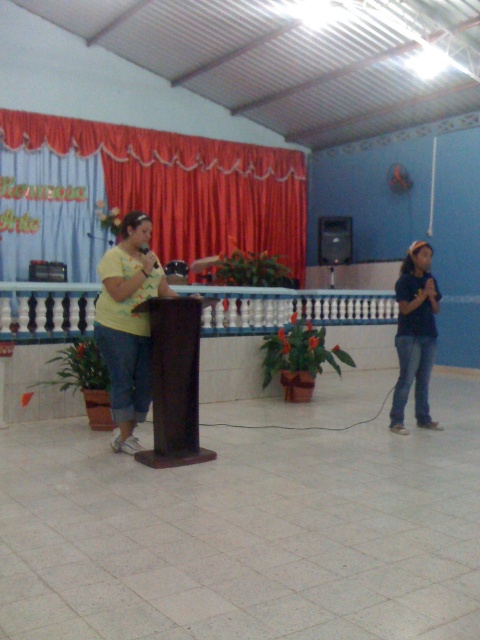
Is yellow matte shirt at center shorter than denim jeans at right?

Incorrect, yellow matte shirt at center's height does not fall short of denim jeans at right's.

Describe the element at coordinates (128, 324) in the screenshot. The image size is (480, 640). I see `yellow matte shirt at center` at that location.

Locate an element on the screen. yellow matte shirt at center is located at coordinates (128, 324).

Where is `red velvet curtain at upper center`? red velvet curtain at upper center is located at coordinates (186, 184).

Can you confirm if red velvet curtain at upper center is positioned below yellow matte shirt at center?

No.

Image resolution: width=480 pixels, height=640 pixels. Describe the element at coordinates (186, 184) in the screenshot. I see `red velvet curtain at upper center` at that location.

Where is `red velvet curtain at upper center`? red velvet curtain at upper center is located at coordinates (186, 184).

Who is positioned more to the left, red velvet curtain at upper center or denim jeans at right?

red velvet curtain at upper center

Does red velvet curtain at upper center appear under denim jeans at right?

No.

Who is more forward, (144,132) or (420,326)?

Point (420,326)

At what (x,y) coordinates should I click in order to perform the action: click on red velvet curtain at upper center. Please return your answer as a coordinate pair (x, y). Looking at the image, I should click on (186, 184).